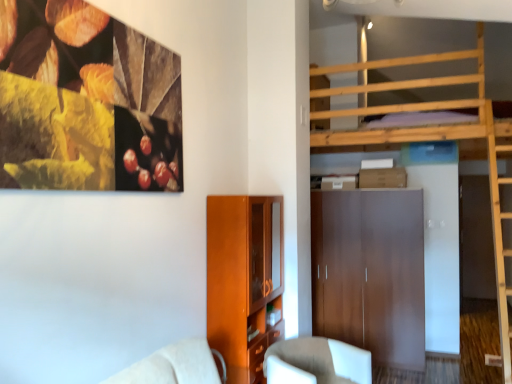
Measure the distance between matte wood cabinet at lower center and camera.

matte wood cabinet at lower center is 9.61 feet away from camera.

Find the location of a particular element. The image size is (512, 384). matte brown wardrobe at center is located at coordinates (370, 273).

Does white fabric chair at lower center have a smaller size compared to matte brown wardrobe at center?

Correct, white fabric chair at lower center occupies less space than matte brown wardrobe at center.

Which of these two, white fabric chair at lower center or matte brown wardrobe at center, is wider?

white fabric chair at lower center is wider.

From a real-world perspective, which object rests below the other?

matte brown wardrobe at center is physically lower.

Find the location of `dresser that appears below the matte wood cabinet at lower center (from a real-world perspective)`. dresser that appears below the matte wood cabinet at lower center (from a real-world perspective) is located at coordinates (370, 273).

Which object is closer to the camera, matte wood cabinet at lower center or matte brown wardrobe at center?

matte wood cabinet at lower center is more forward.

Considering the relative positions of matte wood cabinet at lower center and matte brown wardrobe at center in the image provided, is matte wood cabinet at lower center to the left or to the right of matte brown wardrobe at center?

Clearly, matte wood cabinet at lower center is on the left of matte brown wardrobe at center in the image.

Which is more to the right, matte brown wardrobe at center or white fabric chair at lower center?

From the viewer's perspective, matte brown wardrobe at center appears more on the right side.

Can you confirm if matte brown wardrobe at center is thinner than white fabric chair at lower center?

Yes, matte brown wardrobe at center is thinner than white fabric chair at lower center.

Would you consider matte brown wardrobe at center to be distant from white fabric chair at lower center?

matte brown wardrobe at center is positioned a significant distance from white fabric chair at lower center.

Would you say matte brown wardrobe at center is outside white fabric chair at lower center?

matte brown wardrobe at center is positioned outside white fabric chair at lower center.

Could you tell me if matte wood cabinet at lower center is facing white fabric chair at lower center?

Yes, matte wood cabinet at lower center is aimed at white fabric chair at lower center.

Is white fabric chair at lower center a part of matte wood cabinet at lower center?

No, white fabric chair at lower center is not inside matte wood cabinet at lower center.

Considering the positions of objects matte wood cabinet at lower center and white fabric chair at lower center in the image provided, who is behind, matte wood cabinet at lower center or white fabric chair at lower center?

matte wood cabinet at lower center is more distant.

From the image's perspective, is matte brown wardrobe at center above or below matte wood cabinet at lower center?

Based on their image positions, matte brown wardrobe at center is located beneath matte wood cabinet at lower center.

The height and width of the screenshot is (384, 512). Identify the location of dresser that appears behind the matte wood cabinet at lower center. (370, 273).

Can you tell me how much matte brown wardrobe at center and matte wood cabinet at lower center differ in facing direction?

89.6 degrees.

Does matte brown wardrobe at center appear on the left side of matte wood cabinet at lower center?

No, matte brown wardrobe at center is not to the left of matte wood cabinet at lower center.

Is white fabric chair at lower center bigger than matte wood cabinet at lower center?

No.

Is white fabric chair at lower center oriented away from matte wood cabinet at lower center?

That's right, white fabric chair at lower center is facing away from matte wood cabinet at lower center.

Between white fabric chair at lower center and matte wood cabinet at lower center, which one is positioned behind?

matte wood cabinet at lower center is further from the camera.

Does white fabric chair at lower center touch matte wood cabinet at lower center?

No, white fabric chair at lower center is not beside matte wood cabinet at lower center.

Where is `chair in front of the matte brown wardrobe at center`? The width and height of the screenshot is (512, 384). chair in front of the matte brown wardrobe at center is located at coordinates (316, 362).

At what (x,y) coordinates should I click in order to perform the action: click on cabinetry on the left of matte brown wardrobe at center. Please return your answer as a coordinate pair (x, y). Looking at the image, I should click on (243, 280).

Looking at the image, which one is located further to matte wood cabinet at lower center, white fabric chair at lower center or matte brown wardrobe at center?

matte brown wardrobe at center lies further to matte wood cabinet at lower center than the other object.

Considering their positions, is matte wood cabinet at lower center positioned closer to white fabric chair at lower center than matte brown wardrobe at center?

Among the two, matte wood cabinet at lower center is located nearer to white fabric chair at lower center.

Estimate the real-world distances between objects in this image. Which object is closer to matte brown wardrobe at center, matte wood cabinet at lower center or white fabric chair at lower center?

white fabric chair at lower center is positioned closer to the anchor matte brown wardrobe at center.

Looking at the image, which one is located closer to matte wood cabinet at lower center, matte brown wardrobe at center or white fabric chair at lower center?

white fabric chair at lower center is positioned closer to the anchor matte wood cabinet at lower center.

From the image, which object appears to be farther from white fabric chair at lower center, matte brown wardrobe at center or matte wood cabinet at lower center?

matte brown wardrobe at center lies further to white fabric chair at lower center than the other object.

Considering their positions, is white fabric chair at lower center positioned closer to matte brown wardrobe at center than matte wood cabinet at lower center?

Based on the image, white fabric chair at lower center appears to be nearer to matte brown wardrobe at center.

Identify the location of cabinetry between white fabric chair at lower center and matte brown wardrobe at center along the z-axis. (243, 280).